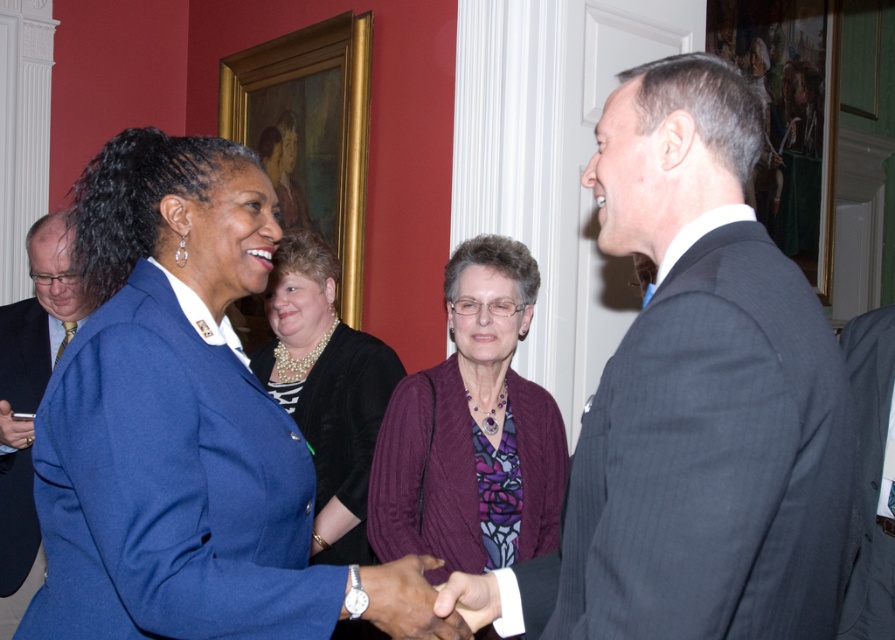
Can you confirm if gray wool suit at right is wider than smooth purple hand at center?

Indeed, gray wool suit at right has a greater width compared to smooth purple hand at center.

Can you confirm if gray wool suit at right is positioned below smooth purple hand at center?

No, gray wool suit at right is not below smooth purple hand at center.

You are a GUI agent. You are given a task and a screenshot of the screen. Output one action in this format:
    pyautogui.click(x=<x>, y=<y>)
    Task: Click on the gray wool suit at right
    
    Given the screenshot: What is the action you would take?
    pyautogui.click(x=871, y=476)

Measure the distance between point (260, 401) and camera.

Point (260, 401) and camera are 4.51 feet apart from each other.

Does matte blue blazer at left have a larger size compared to smooth purple hand at center?

Yes.

You are a GUI agent. You are given a task and a screenshot of the screen. Output one action in this format:
    pyautogui.click(x=<x>, y=<y>)
    Task: Click on the matte blue blazer at left
    The image size is (895, 640).
    Given the screenshot: What is the action you would take?
    pyautogui.click(x=171, y=484)

At what (x,y) coordinates should I click in order to perform the action: click on matte blue blazer at left. Please return your answer as a coordinate pair (x, y). Looking at the image, I should click on (171, 484).

Is purple ribbed sweater at center bigger than gray wool suit at right?

Yes, purple ribbed sweater at center is bigger than gray wool suit at right.

Where is `purple ribbed sweater at center`? Image resolution: width=895 pixels, height=640 pixels. purple ribbed sweater at center is located at coordinates (472, 432).

Locate an element on the screen. This screenshot has width=895, height=640. purple ribbed sweater at center is located at coordinates (472, 432).